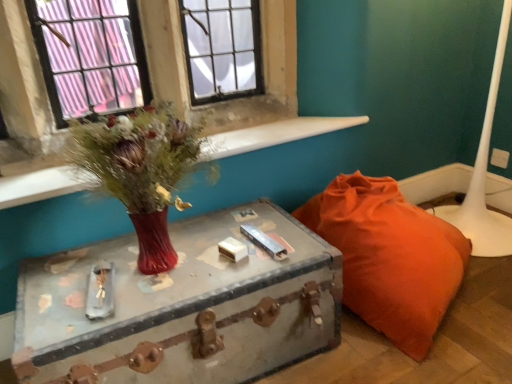
Question: From the image's perspective, is white glossy table lamp at lower right on top of matte glass vase at upper left?

Choices:
 (A) yes
 (B) no

Answer: (A)

Question: From a real-world perspective, is white glossy table lamp at lower right located beneath matte glass vase at upper left?

Choices:
 (A) yes
 (B) no

Answer: (A)

Question: Is there a large distance between white glossy table lamp at lower right and matte glass vase at upper left?

Choices:
 (A) no
 (B) yes

Answer: (A)

Question: Does white glossy table lamp at lower right have a larger size compared to matte glass vase at upper left?

Choices:
 (A) no
 (B) yes

Answer: (B)

Question: Is matte glass vase at upper left surrounded by white glossy table lamp at lower right?

Choices:
 (A) no
 (B) yes

Answer: (A)

Question: Can you confirm if white glossy table lamp at lower right is positioned to the right of matte glass vase at upper left?

Choices:
 (A) yes
 (B) no

Answer: (A)

Question: Is matte red vase at upper left oriented towards orange fabric bean bag at lower right?

Choices:
 (A) no
 (B) yes

Answer: (A)

Question: Considering the relative sizes of matte red vase at upper left and orange fabric bean bag at lower right in the image provided, is matte red vase at upper left smaller than orange fabric bean bag at lower right?

Choices:
 (A) no
 (B) yes

Answer: (B)

Question: Is orange fabric bean bag at lower right completely or partially inside matte red vase at upper left?

Choices:
 (A) yes
 (B) no

Answer: (B)

Question: From the image's perspective, is matte red vase at upper left located beneath orange fabric bean bag at lower right?

Choices:
 (A) yes
 (B) no

Answer: (B)

Question: Considering the relative sizes of matte red vase at upper left and orange fabric bean bag at lower right in the image provided, is matte red vase at upper left shorter than orange fabric bean bag at lower right?

Choices:
 (A) yes
 (B) no

Answer: (A)

Question: Is matte red vase at upper left to the right of orange fabric bean bag at lower right from the viewer's perspective?

Choices:
 (A) yes
 (B) no

Answer: (B)

Question: Is rusty metal trunk at center shorter than orange fabric bean bag at lower right?

Choices:
 (A) no
 (B) yes

Answer: (B)